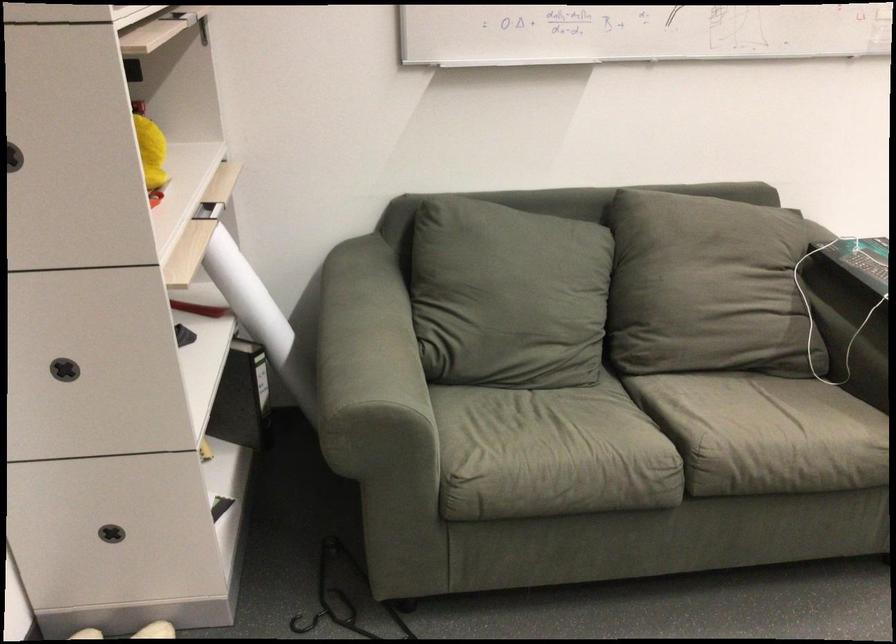
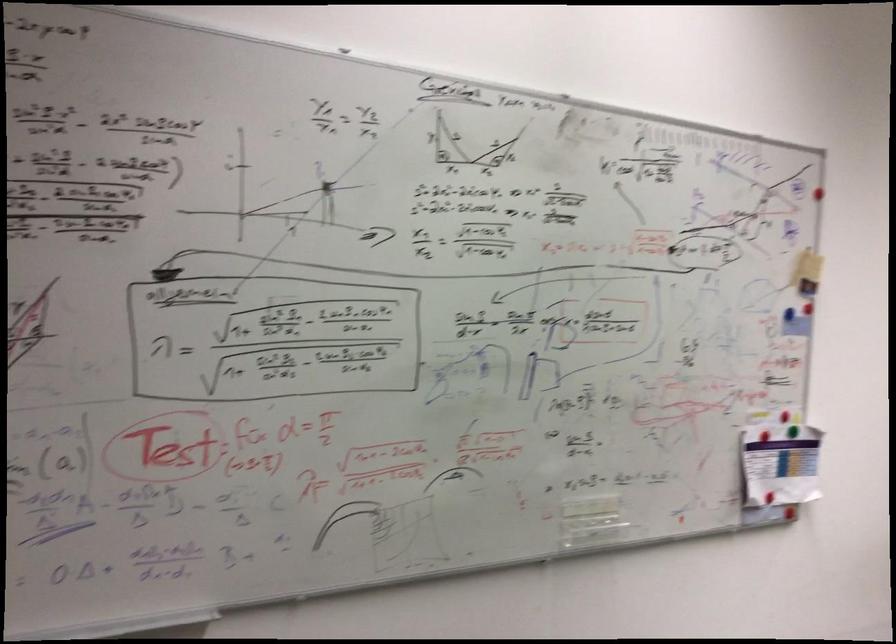
First-person continuous shooting, in which direction is the camera rotating?

The camera rotated toward right-up.